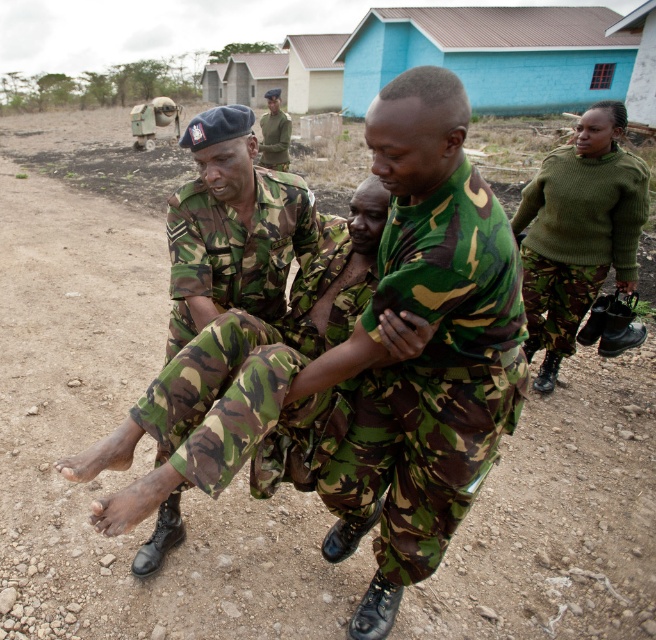
Question: From the image, what is the correct spatial relationship of camo fabric pants at center in relation to camouflage uniform at center?

Choices:
 (A) below
 (B) above

Answer: (A)

Question: Which of the following is the closest to the observer?

Choices:
 (A) pos(276,152)
 (B) pos(359,301)
 (C) pos(363,506)
 (D) pos(560,250)

Answer: (B)

Question: Which point appears farthest from the camera in this image?

Choices:
 (A) (567, 218)
 (B) (262, 161)
 (C) (300, 444)
 (D) (474, 330)

Answer: (B)

Question: Does camo fabric pants at center come behind green knitted sweater at right?

Choices:
 (A) no
 (B) yes

Answer: (A)

Question: Which object appears farthest from the camera in this image?

Choices:
 (A) camouflage fabric uniform at center
 (B) camo fabric pants at center
 (C) camouflage uniform at center

Answer: (C)

Question: Does camouflage fabric uniform at center appear over green knitted sweater at right?

Choices:
 (A) yes
 (B) no

Answer: (B)